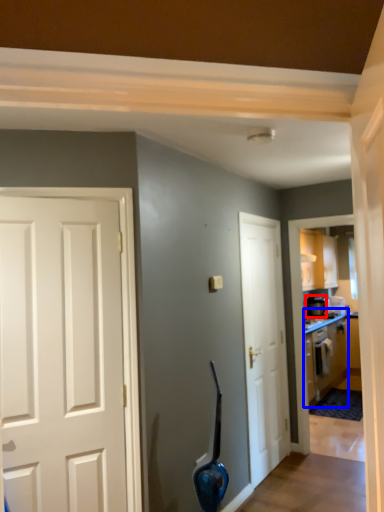
Question: Which of the following is the farthest to the observer, appliance (highlighted by a red box) or cabinetry (highlighted by a blue box)?

Choices:
 (A) appliance
 (B) cabinetry

Answer: (A)